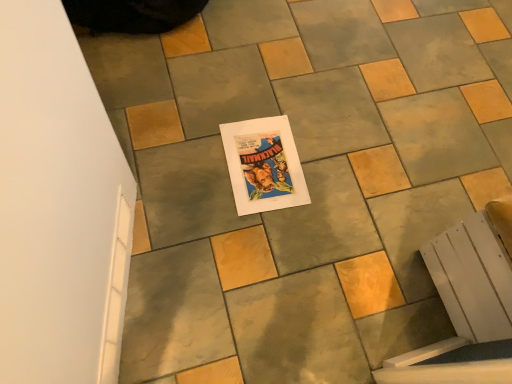
Find the location of a particular element. This screenshot has width=512, height=384. free point below vibrant paper comic book at center (from a real-world perspective) is located at coordinates (261, 165).